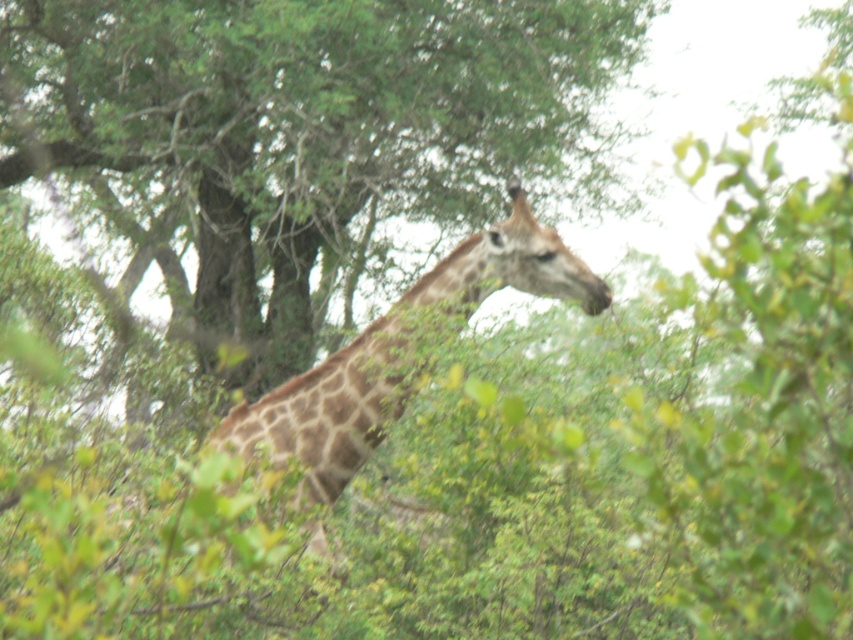
You are standing at the point marked as point [310,129] and looking towards the giraffe. Which direction should you move to get closer to the giraffe?

The green leafy tree at center is located at point [310,129]. Since the giraffe is positioned slightly off center, you should move away from the green leafy tree at center to get closer to the giraffe.

You are a drone operator trying to capture aerial footage of the giraffe. You have two points marked on your screen for camera positioning. The first point is at coordinate point(234, 380) and the second is at point(419, 300). Based on the scene, which point would be a better choice to position the camera so that the giraffe is fully visible without any obstruction?

Point(419, 300) is in front of point(234, 380), so positioning the camera at point(419, 300) would provide a clearer view of the giraffe without obstruction from the dense foliage in the background.